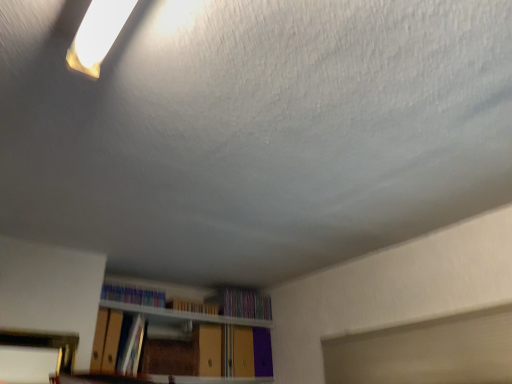
Question: Does hardcover book at center, which is the 3th book from left to right, have a larger size compared to hardcover book at center, which is the second book from left to right?

Choices:
 (A) no
 (B) yes

Answer: (A)

Question: Is hardcover book at center, the second book from the right, positioned far away from hardcover book at center, which ranks as the 3th book in right-to-left order?

Choices:
 (A) no
 (B) yes

Answer: (A)

Question: Does hardcover book at center, which is the 3th book from left to right, turn towards hardcover book at center, which ranks as the 3th book in right-to-left order?

Choices:
 (A) yes
 (B) no

Answer: (B)

Question: From the image's perspective, would you say hardcover book at center, which is the 3th book from left to right, is positioned over hardcover book at center, which is the second book from left to right?

Choices:
 (A) no
 (B) yes

Answer: (B)

Question: From a real-world perspective, is hardcover book at center, the second book from the right, below hardcover book at center, which ranks as the 3th book in right-to-left order?

Choices:
 (A) yes
 (B) no

Answer: (B)

Question: Is hardcover book at center, which is the 3th book from left to right, at the right side of hardcover book at center, which ranks as the 3th book in right-to-left order?

Choices:
 (A) yes
 (B) no

Answer: (A)

Question: Is multicolored plastic books at upper center, which is the first book in left-to-right order, completely or partially inside hardcover book at center, which is the second book from left to right?

Choices:
 (A) yes
 (B) no

Answer: (B)

Question: Is hardcover book at center, which ranks as the 3th book in right-to-left order, next to multicolored plastic books at upper center, which is the first book in left-to-right order, and touching it?

Choices:
 (A) no
 (B) yes

Answer: (A)

Question: Is hardcover book at center, which is the second book from left to right, in front of multicolored plastic books at upper center, which is the first book in left-to-right order?

Choices:
 (A) yes
 (B) no

Answer: (A)

Question: Is hardcover book at center, which ranks as the 3th book in right-to-left order, facing towards multicolored plastic books at upper center, which appears as the fourth book when viewed from the right?

Choices:
 (A) no
 (B) yes

Answer: (A)

Question: From a real-world perspective, is hardcover book at center, which is the second book from left to right, below multicolored plastic books at upper center, which appears as the fourth book when viewed from the right?

Choices:
 (A) no
 (B) yes

Answer: (B)

Question: Can you confirm if hardcover book at center, which ranks as the 3th book in right-to-left order, is bigger than multicolored plastic books at upper center, which is the first book in left-to-right order?

Choices:
 (A) yes
 (B) no

Answer: (A)

Question: Does multicolored paper at center, marked as the 1th book in a right-to-left arrangement, appear on the left side of hardcover book at center, the second book from the right?

Choices:
 (A) yes
 (B) no

Answer: (B)